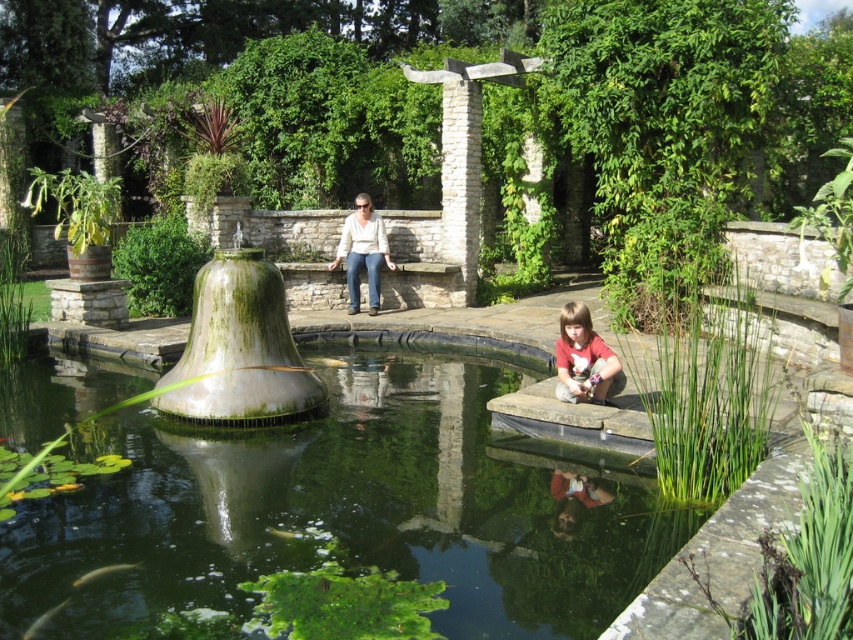
You are a drone operator trying to capture a photo of the light beige sweater at center in the garden scene. The drone has a camera with a 10cm focal length and is currently positioned at point A. To ensure the sweater is in focus, where should you adjust the drone to position B so that it is directly above the sweater? Provide the coordinates of point B in the format x,y.

The light beige sweater at center is located at point (363,252). To position the drone directly above it, point B should be at coordinates (363,252).

You are looking at the garden scene and see a point marked at coordinates (363,252). Based on the description, where is this point located?

The point at (363,252) is located on the light beige sweater at center.